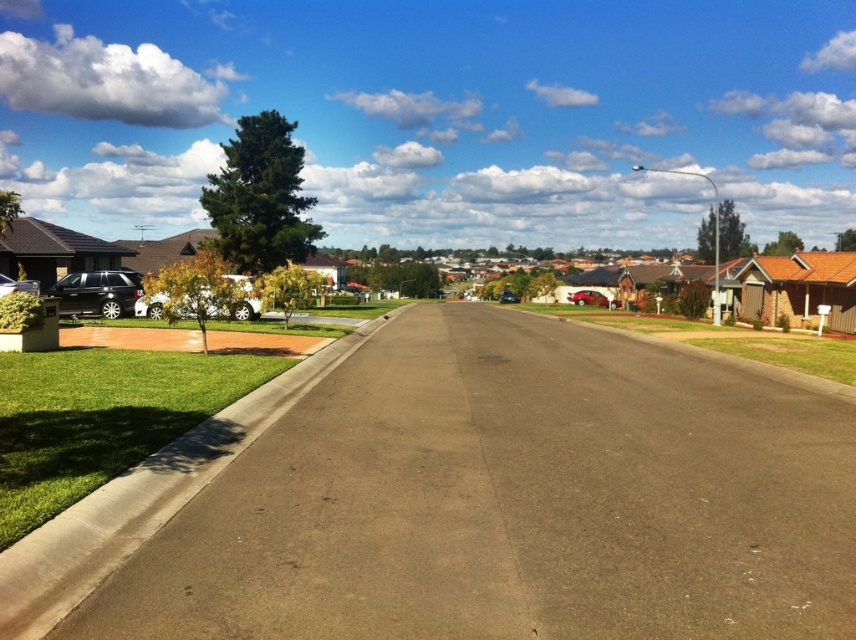
Question: Which object is positioned farthest from the shiny silver sedan at left?

Choices:
 (A) shiny red sedan at center-right
 (B) metallic blue sedan at center

Answer: (B)

Question: Is shiny black car at left wider than shiny red sedan at center-right?

Choices:
 (A) yes
 (B) no

Answer: (B)

Question: Which is farther from the shiny black car at left?

Choices:
 (A) shiny red sedan at center-right
 (B) metallic blue sedan at center
 (C) shiny silver sedan at left

Answer: (B)

Question: Can you confirm if shiny black car at left is bigger than metallic blue sedan at center?

Choices:
 (A) no
 (B) yes

Answer: (A)

Question: Which point appears farthest from the camera in this image?

Choices:
 (A) (x=21, y=288)
 (B) (x=502, y=296)
 (C) (x=134, y=308)

Answer: (B)

Question: From the image, what is the correct spatial relationship of shiny silver sedan at left in relation to metallic blue sedan at center?

Choices:
 (A) below
 (B) above

Answer: (A)